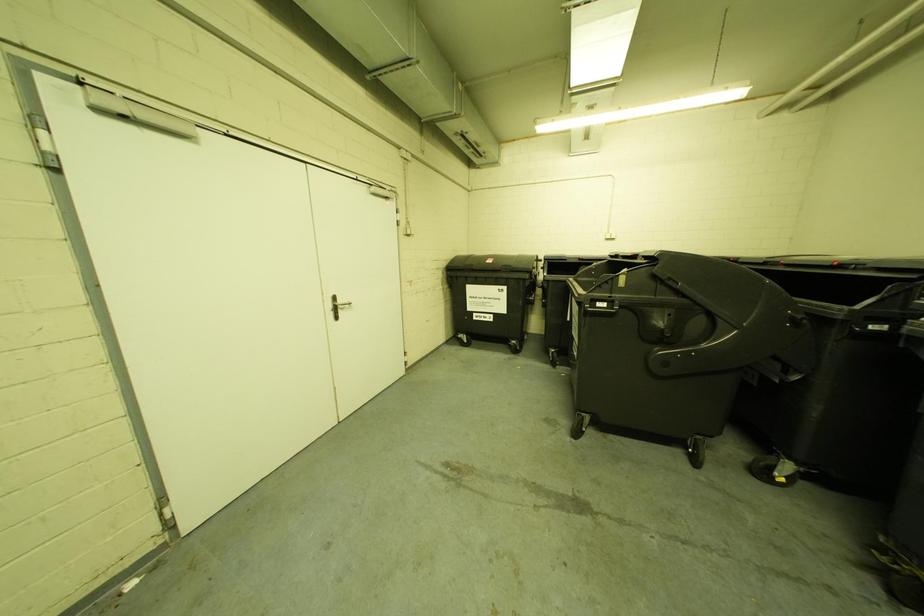
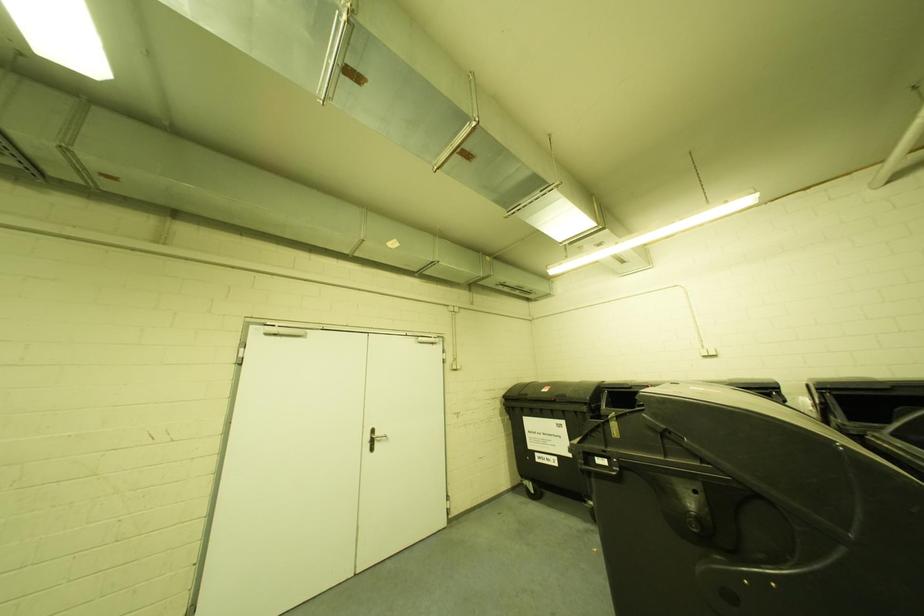
The first image is from the beginning of the video and the second image is from the end. How did the camera likely rotate when shooting the video?

The camera rotated toward left-up.